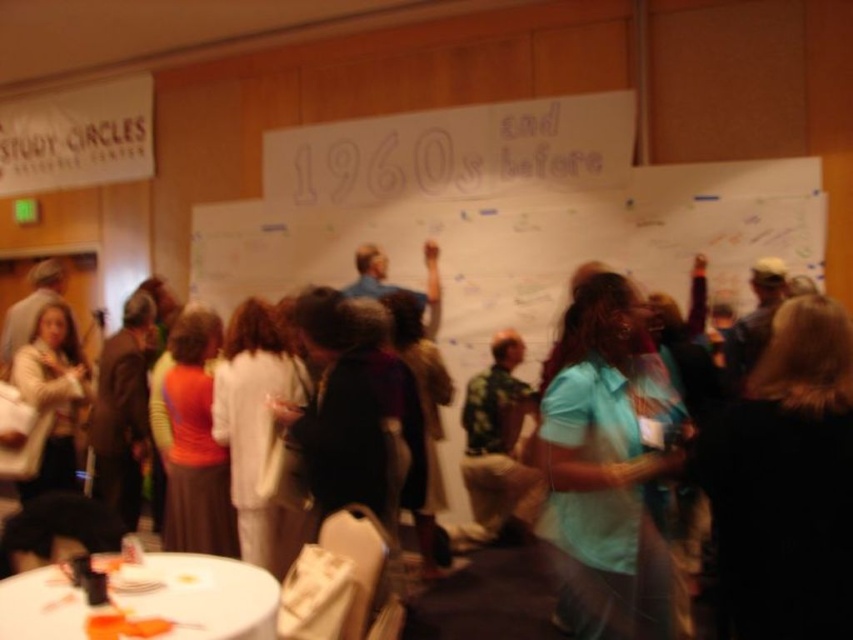
Consider the image. You are standing in the room and looking at the whiteboard. There are two points marked on the whiteboard at coordinates point (624, 525) and point (218, 592). Which point is closer to you?

Point (624, 525) is closer to the camera than point (218, 592).

You are organizing a meeting and need to place a laptop on the white plastic table at lower left. However, there is a camouflage shirt at center nearby. Which object should you move to make space for the laptop?

The camouflage shirt at center is to the right of the white plastic table at lower left, so you should move the camouflage shirt at center to make space for the laptop on the white plastic table at lower left.